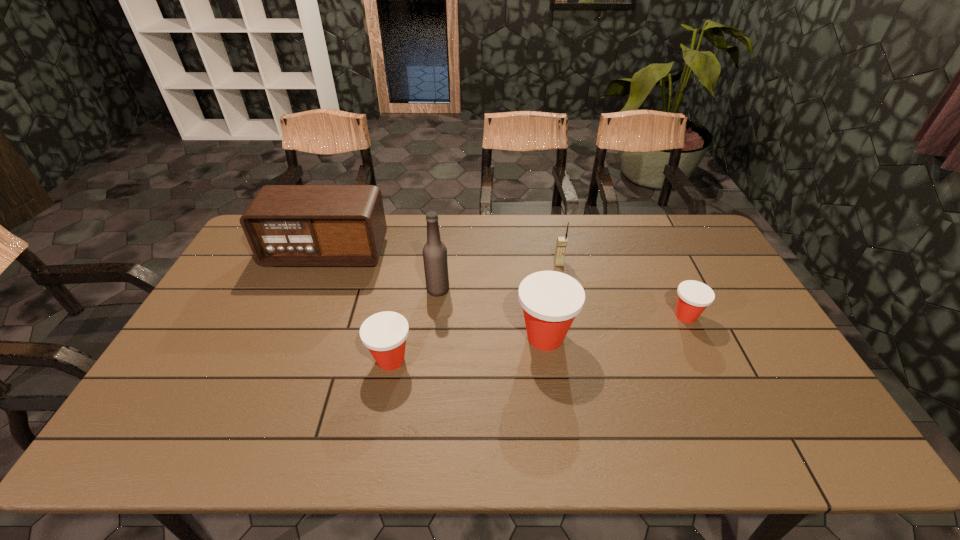
I want to click on vacant space situated on the right of the fifth tallest object, so click(x=443, y=360).

Locate an element on the screen. The height and width of the screenshot is (540, 960). vacant space situated on the back of the second Dixie cup from right to left is located at coordinates (537, 276).

The width and height of the screenshot is (960, 540). Identify the location of free space located on the right of the rightmost object. (759, 316).

The width and height of the screenshot is (960, 540). I want to click on vacant point located on the front-facing side of the leftmost object, so click(304, 309).

You are a GUI agent. You are given a task and a screenshot of the screen. Output one action in this format:
    pyautogui.click(x=<x>, y=<y>)
    Task: Click on the free spot located 0.260m on the label of the fourth object from right to left
    The width and height of the screenshot is (960, 540).
    Given the screenshot: What is the action you would take?
    pyautogui.click(x=532, y=289)

The image size is (960, 540). What are the coordinates of `free point located on the front of the cellular telephone, where the keypad is located` in the screenshot? It's located at [575, 341].

In order to click on object located in the far edge section of the desktop in this screenshot , I will do `click(285, 225)`.

This screenshot has width=960, height=540. In order to click on object that is at the left edge in this screenshot , I will do point(285,225).

This screenshot has height=540, width=960. What are the coordinates of `object at the far left corner` in the screenshot? It's located at (285, 225).

Locate an element on the screen. The width and height of the screenshot is (960, 540). vacant space at the near edge of the desktop is located at coordinates (369, 414).